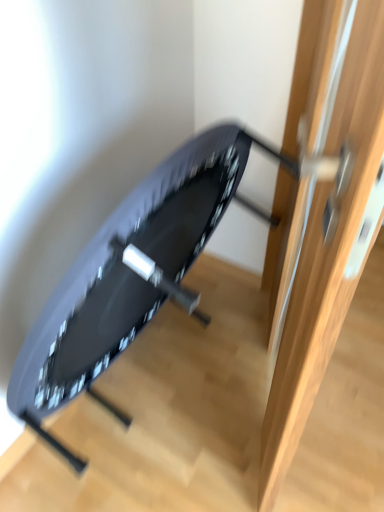
Question: Is wooden door at center in front of or behind matte black swivel chair at center in the image?

Choices:
 (A) behind
 (B) front

Answer: (B)

Question: In the image, is wooden door at center on the left side or the right side of matte black swivel chair at center?

Choices:
 (A) left
 (B) right

Answer: (B)

Question: From the image's perspective, is wooden door at center above or below matte black swivel chair at center?

Choices:
 (A) below
 (B) above

Answer: (B)

Question: Is matte black swivel chair at center in front of or behind wooden door at center in the image?

Choices:
 (A) behind
 (B) front

Answer: (A)

Question: Is matte black swivel chair at center spatially inside wooden door at center, or outside of it?

Choices:
 (A) inside
 (B) outside

Answer: (B)

Question: Does point (198, 159) appear closer or farther from the camera than point (319, 386)?

Choices:
 (A) closer
 (B) farther

Answer: (A)

Question: From a real-world perspective, is matte black swivel chair at center positioned above or below wooden door at center?

Choices:
 (A) below
 (B) above

Answer: (A)